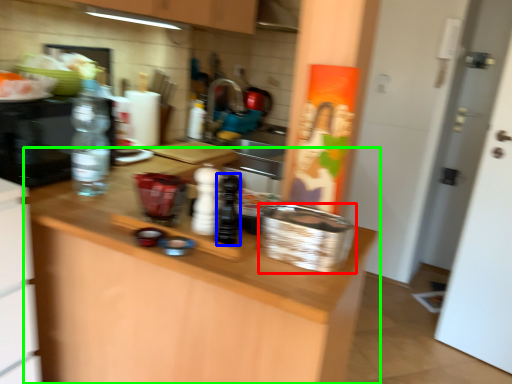
Question: Estimate the real-world distances between objects in this image. Which object is farther from basket (highlighted by a red box), bottle (highlighted by a blue box) or countertop (highlighted by a green box)?

Choices:
 (A) bottle
 (B) countertop

Answer: (B)